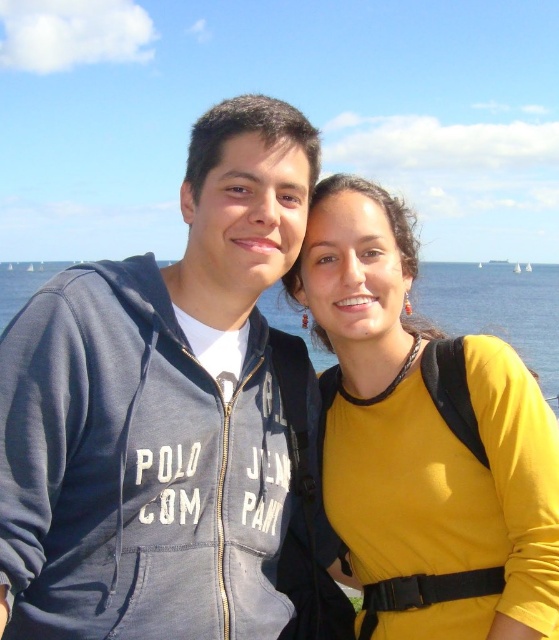
You are a photographer trying to capture the blue water at center and the white sailboat at center in a single shot. Which object should you focus on first if you want to ensure both are in frame without moving the camera?

The blue water at center has a greater height compared to the white sailboat at center, so you should focus on the blue water at center first to ensure both fit within the frame.